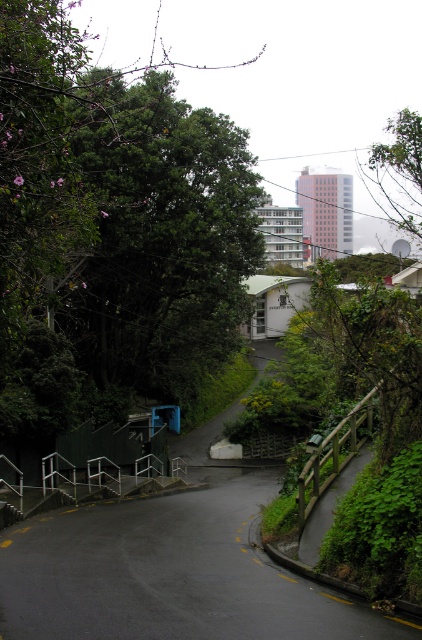
You are a hiker who wants to take a photo of both the green leafy tree at upper left and the green leafy tree at upper right in the scene. Which tree should you stand closer to in order to capture both in a single frame?

You should stand closer to the green leafy tree at upper left because it is thinner than the green leafy tree at upper right, allowing you to fit both trees within the camera frame by positioning yourself nearer to the smaller tree.

Looking at this image, you are standing at the point marked by the coordinates point at (161, 240). Looking around, what object is located at that exact coordinate?

The point at (161, 240) corresponds to the green leafy tree at upper left.

You are a hiker planning to take a photo of the green leafy tree at upper left and the black asphalt road at center. Which object should you focus on first if you want both to be in sharp focus, considering their sizes?

Since the green leafy tree at upper left is bigger than the black asphalt road at center, you should focus on the larger object first to ensure both are in sharp focus.